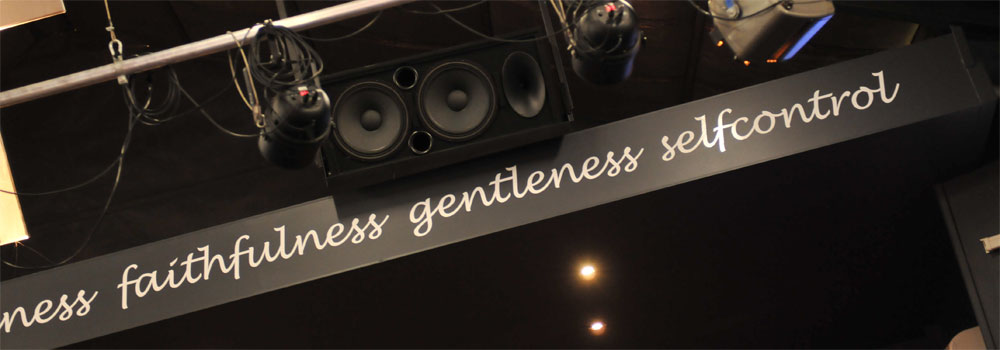
Where is `yellow light`? Image resolution: width=1000 pixels, height=350 pixels. yellow light is located at coordinates (587, 264).